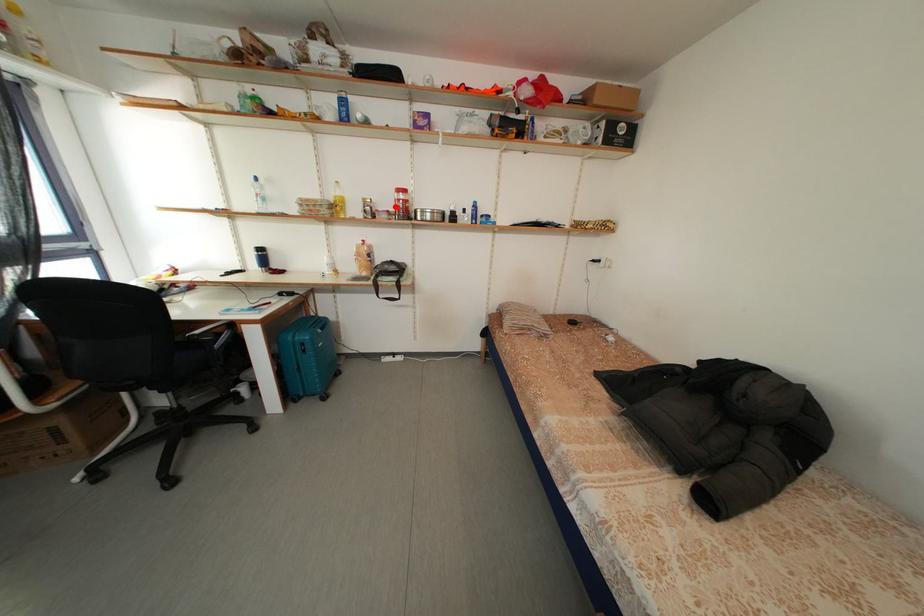
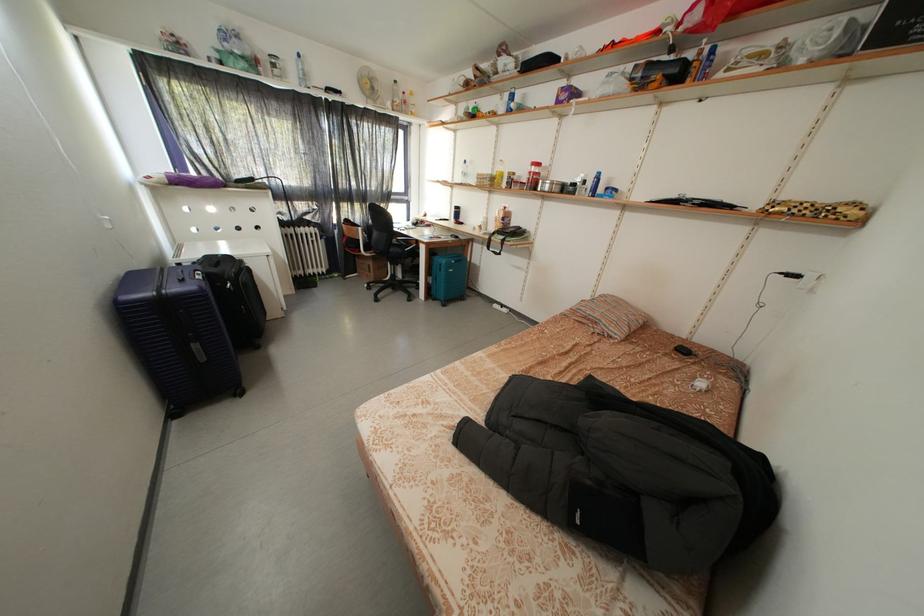
Question: A red point is marked in image1. In image2, is the corresponding 3D point closer to the camera or farther? Reply with the corresponding letter.

Choices:
 (A) The corresponding 3D point is closer.
 (B) The corresponding 3D point is farther.

Answer: (A)